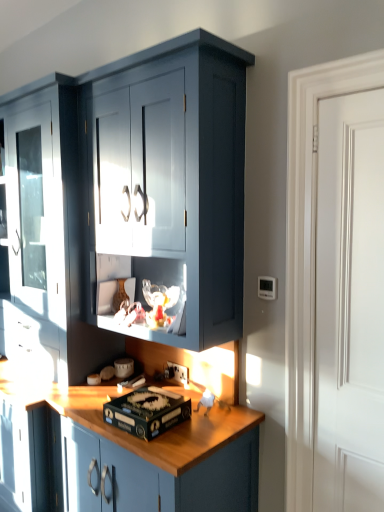
Identify the location of black cardboard box at center. (147, 411).

This screenshot has width=384, height=512. What do you see at coordinates (147, 411) in the screenshot?
I see `black cardboard box at center` at bounding box center [147, 411].

Describe the element at coordinates (129, 199) in the screenshot. The image size is (384, 512). I see `matte dark blue cabinet at center` at that location.

You are a GUI agent. You are given a task and a screenshot of the screen. Output one action in this format:
    pyautogui.click(x=<x>, y=<y>)
    Task: Click on the white smooth door at right
    The height and width of the screenshot is (512, 384).
    Given the screenshot: What is the action you would take?
    pyautogui.click(x=350, y=304)

Considering their positions, is white plastic electric outlet at lower center located in front of or behind white smooth door at right?

white plastic electric outlet at lower center is behind white smooth door at right.

Considering the positions of objects white plastic electric outlet at lower center and white smooth door at right in the image provided, who is more to the right, white plastic electric outlet at lower center or white smooth door at right?

white smooth door at right.

From the image's perspective, which one is positioned higher, white plastic electric outlet at lower center or white smooth door at right?

white smooth door at right, from the image's perspective.

From a real-world perspective, is matte dark blue cabinet at center physically below black cardboard box at center?

No, from a real-world perspective, matte dark blue cabinet at center is not beneath black cardboard box at center.

Is matte dark blue cabinet at center aimed at black cardboard box at center?

Yes, matte dark blue cabinet at center is facing black cardboard box at center.

From the image's perspective, relative to black cardboard box at center, is matte dark blue cabinet at center above or below?

From the image's perspective, matte dark blue cabinet at center appears above black cardboard box at center.

Is white smooth door at right facing towards black cardboard box at center?

No, white smooth door at right is not facing towards black cardboard box at center.

Measure the distance from white smooth door at right to black cardboard box at center.

A distance of 30.30 inches exists between white smooth door at right and black cardboard box at center.

Is white smooth door at right at the right side of black cardboard box at center?

Yes.

Does white smooth door at right have a lesser width compared to black cardboard box at center?

Correct, the width of white smooth door at right is less than that of black cardboard box at center.

Could you tell me if matte dark blue cabinet at center is turned towards white plastic electric outlet at lower center?

Yes, matte dark blue cabinet at center is aimed at white plastic electric outlet at lower center.

What's the angular difference between matte dark blue cabinet at center and white plastic electric outlet at lower center's facing directions?

0.715 degrees.

Is matte dark blue cabinet at center inside the boundaries of white plastic electric outlet at lower center, or outside?

matte dark blue cabinet at center is not enclosed by white plastic electric outlet at lower center.

From a real-world perspective, which is physically below, matte dark blue cabinet at center or white plastic electric outlet at lower center?

white plastic electric outlet at lower center.

Considering the sizes of objects white smooth door at right and matte dark blue cabinet at center in the image provided, who is thinner, white smooth door at right or matte dark blue cabinet at center?

Thinner between the two is white smooth door at right.

Could matte dark blue cabinet at center be considered to be inside white smooth door at right?

That's incorrect, matte dark blue cabinet at center is not inside white smooth door at right.

Based on the photo, is white smooth door at right to the left of matte dark blue cabinet at center from the viewer's perspective?

In fact, white smooth door at right is to the right of matte dark blue cabinet at center.

In terms of height, does white smooth door at right look taller or shorter compared to matte dark blue cabinet at center?

white smooth door at right is shorter than matte dark blue cabinet at center.

Is white plastic electric outlet at lower center positioned far away from black cardboard box at center?

No, white plastic electric outlet at lower center is not far from black cardboard box at center.

Does point (177, 366) appear closer or farther from the camera than point (190, 415)?

Point (177, 366) is farther from the camera than point (190, 415).

From the image's perspective, relative to black cardboard box at center, is white plastic electric outlet at lower center above or below?

From the image's perspective, white plastic electric outlet at lower center appears above black cardboard box at center.

From a real-world perspective, between white plastic electric outlet at lower center and black cardboard box at center, who is vertically lower?

In real-world perspective, black cardboard box at center is lower.

Is white smooth door at right outside of white plastic electric outlet at lower center?

Absolutely, white smooth door at right is external to white plastic electric outlet at lower center.

Which object is thinner, white smooth door at right or white plastic electric outlet at lower center?

white plastic electric outlet at lower center.

Where is `door on the right of white plastic electric outlet at lower center`? The image size is (384, 512). door on the right of white plastic electric outlet at lower center is located at coordinates (350, 304).

There is a black cardboard box at center. At what (x,y) coordinates should I click in order to perform the action: click on cabinetry above it (from a real-world perspective). Please return your answer as a coordinate pair (x, y). Image resolution: width=384 pixels, height=512 pixels. Looking at the image, I should click on (129, 199).

When comparing their distances from white plastic electric outlet at lower center, does white smooth door at right or black cardboard box at center seem further?

white smooth door at right.

Looking at the image, which one is located further to black cardboard box at center, matte dark blue cabinet at center or white smooth door at right?

white smooth door at right lies further to black cardboard box at center than the other object.

When comparing their distances from white smooth door at right, does white plastic electric outlet at lower center or black cardboard box at center seem closer?

black cardboard box at center is positioned closer to the anchor white smooth door at right.

Considering their positions, is white plastic electric outlet at lower center positioned further to black cardboard box at center than white smooth door at right?

Among the two, white smooth door at right is located further to black cardboard box at center.

From the image, which object appears to be farther from matte dark blue cabinet at center, white plastic electric outlet at lower center or black cardboard box at center?

The object further to matte dark blue cabinet at center is white plastic electric outlet at lower center.

When comparing their distances from white plastic electric outlet at lower center, does matte dark blue cabinet at center or white smooth door at right seem closer?

matte dark blue cabinet at center.

When comparing their distances from black cardboard box at center, does matte dark blue cabinet at center or white plastic electric outlet at lower center seem closer?

white plastic electric outlet at lower center lies closer to black cardboard box at center than the other object.

Estimate the real-world distances between objects in this image. Which object is closer to matte dark blue cabinet at center, white smooth door at right or white plastic electric outlet at lower center?

white smooth door at right is positioned closer to the anchor matte dark blue cabinet at center.

The image size is (384, 512). Identify the location of electric outlet between matte dark blue cabinet at center and white smooth door at right. (179, 373).

Identify the location of appliance between matte dark blue cabinet at center and white plastic electric outlet at lower center in the horizontal direction. This screenshot has width=384, height=512. (147, 411).

You are a GUI agent. You are given a task and a screenshot of the screen. Output one action in this format:
    pyautogui.click(x=<x>, y=<y>)
    Task: Click on the electric outlet between black cardboard box at center and white smooth door at right in the horizontal direction
    The width and height of the screenshot is (384, 512).
    Given the screenshot: What is the action you would take?
    pyautogui.click(x=179, y=373)

Find the location of a particular element. appliance between matte dark blue cabinet at center and white smooth door at right from left to right is located at coordinates (147, 411).